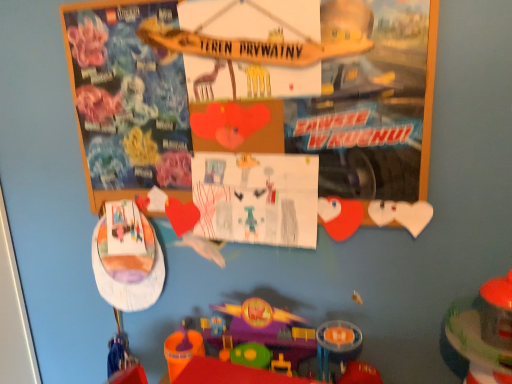
Question: In the image, is colored paper drawing at center positioned in front of or behind translucent plastic toy at lower right, which is the first toy in right-to-left order?

Choices:
 (A) front
 (B) behind

Answer: (B)

Question: From a real-world perspective, relative to translucent plastic toy at lower right, which is the first toy in right-to-left order, is colored paper drawing at center vertically above or below?

Choices:
 (A) below
 (B) above

Answer: (B)

Question: Estimate the real-world distances between objects in this image. Which object is farther from the translucent plastic toy at lower right, placed as the third toy when sorted from left to right?

Choices:
 (A) matte plastic plate at left, the 3th toy positioned from the right
 (B) wooden sign at upper center
 (C) plastic toy train at center, the 2th toy in the left-to-right sequence
 (D) colored paper drawing at center

Answer: (A)

Question: Which is farther from the matte plastic plate at left, placed as the first toy when sorted from left to right?

Choices:
 (A) wooden sign at upper center
 (B) plastic toy train at center, the 2th toy in the right-to-left sequence
 (C) colored paper drawing at center
 (D) translucent plastic toy at lower right, which is the first toy in right-to-left order

Answer: (D)